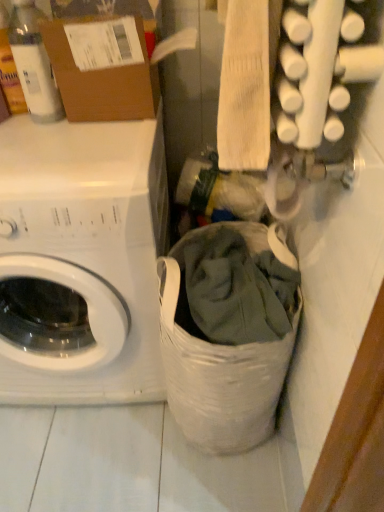
The height and width of the screenshot is (512, 384). Describe the element at coordinates (33, 63) in the screenshot. I see `translucent plastic bottle at upper left` at that location.

The image size is (384, 512). I want to click on brown cardboard box at upper left, so pyautogui.click(x=102, y=68).

Is brown cardboard box at upper left placed right next to white matte washing machine at left?

No, brown cardboard box at upper left is not next to white matte washing machine at left.

Looking at the image, does brown cardboard box at upper left seem bigger or smaller compared to white matte washing machine at left?

brown cardboard box at upper left is smaller than white matte washing machine at left.

Measure the distance between brown cardboard box at upper left and white matte washing machine at left.

brown cardboard box at upper left and white matte washing machine at left are 12.84 inches apart.

What's the angular difference between brown cardboard box at upper left and white matte washing machine at left's facing directions?

1.32 degrees.

Which object is wider, white fabric laundry basket at lower center or white matte washing machine at left?

white matte washing machine at left.

Locate an element on the screen. The height and width of the screenshot is (512, 384). washing machine above the white fabric laundry basket at lower center (from the image's perspective) is located at coordinates [81, 261].

Does white fabric laundry basket at lower center touch white matte washing machine at left?

No, white fabric laundry basket at lower center is not touching white matte washing machine at left.

Which object is thinner, white fabric laundry basket at lower center or brown cardboard box at upper left?

brown cardboard box at upper left.

Is white fabric laundry basket at lower center inside or outside of brown cardboard box at upper left?

white fabric laundry basket at lower center lies outside brown cardboard box at upper left.

Does white fabric laundry basket at lower center come behind brown cardboard box at upper left?

No, the depth of white fabric laundry basket at lower center is less than that of brown cardboard box at upper left.

You are a GUI agent. You are given a task and a screenshot of the screen. Output one action in this format:
    pyautogui.click(x=<x>, y=<y>)
    Task: Click on the cardboard box located above the white fabric laundry basket at lower center (from a real-world perspective)
    This screenshot has width=384, height=512.
    Given the screenshot: What is the action you would take?
    pyautogui.click(x=102, y=68)

In terms of height, does white matte washing machine at left look taller or shorter compared to translucent plastic bottle at upper left?

Clearly, white matte washing machine at left is taller compared to translucent plastic bottle at upper left.

From a real-world perspective, which object rests below the other?

white matte washing machine at left.

Is white matte washing machine at left looking in the opposite direction of translucent plastic bottle at upper left?

That's not correct — white matte washing machine at left is not looking away from translucent plastic bottle at upper left.

From a real-world perspective, is translucent plastic bottle at upper left on top of white matte washing machine at left?

Correct, in the physical world, translucent plastic bottle at upper left is higher than white matte washing machine at left.

In terms of size, does translucent plastic bottle at upper left appear bigger or smaller than white matte washing machine at left?

In the image, translucent plastic bottle at upper left appears to be smaller than white matte washing machine at left.

Does translucent plastic bottle at upper left have a lesser width compared to white matte washing machine at left?

Correct, the width of translucent plastic bottle at upper left is less than that of white matte washing machine at left.

Is the surface of translucent plastic bottle at upper left in direct contact with white matte washing machine at left?

They are not placed beside each other.

Between point (83, 23) and point (13, 10), which one is positioned in front?

Positioned in front is point (83, 23).

From their relative heights in the image, would you say brown cardboard box at upper left is taller or shorter than translucent plastic bottle at upper left?

In the image, brown cardboard box at upper left appears to be shorter than translucent plastic bottle at upper left.

Is brown cardboard box at upper left at the right side of translucent plastic bottle at upper left?

Yes.

Based on their sizes in the image, would you say brown cardboard box at upper left is bigger or smaller than translucent plastic bottle at upper left?

brown cardboard box at upper left is bigger than translucent plastic bottle at upper left.

From the image's perspective, is translucent plastic bottle at upper left below white fabric laundry basket at lower center?

No.

Between translucent plastic bottle at upper left and white fabric laundry basket at lower center, which one has smaller width?

Thinner between the two is translucent plastic bottle at upper left.

Based on the photo, is the depth of translucent plastic bottle at upper left greater than that of white fabric laundry basket at lower center?

Yes, translucent plastic bottle at upper left is behind white fabric laundry basket at lower center.

Where is `washing machine below the brown cardboard box at upper left (from a real-world perspective)`? The height and width of the screenshot is (512, 384). washing machine below the brown cardboard box at upper left (from a real-world perspective) is located at coordinates (81, 261).

Locate an element on the screen. laundry basket lying below the white matte washing machine at left (from the image's perspective) is located at coordinates (219, 377).

Which object lies further to the anchor point brown cardboard box at upper left, white matte washing machine at left or translucent plastic bottle at upper left?

Among the two, white matte washing machine at left is located further to brown cardboard box at upper left.

From the image, which object appears to be nearer to brown cardboard box at upper left, white fabric laundry basket at lower center or white matte washing machine at left?

white matte washing machine at left lies closer to brown cardboard box at upper left than the other object.

Looking at the image, which one is located closer to translucent plastic bottle at upper left, white matte washing machine at left or white fabric laundry basket at lower center?

white matte washing machine at left lies closer to translucent plastic bottle at upper left than the other object.

When comparing their distances from white matte washing machine at left, does brown cardboard box at upper left or white fabric laundry basket at lower center seem further?

Among the two, brown cardboard box at upper left is located further to white matte washing machine at left.

Which object lies further to the anchor point white fabric laundry basket at lower center, white matte washing machine at left or brown cardboard box at upper left?

Among the two, brown cardboard box at upper left is located further to white fabric laundry basket at lower center.

When comparing their distances from white matte washing machine at left, does white fabric laundry basket at lower center or translucent plastic bottle at upper left seem further?

The object further to white matte washing machine at left is translucent plastic bottle at upper left.

Which object lies nearer to the anchor point white fabric laundry basket at lower center, white matte washing machine at left or translucent plastic bottle at upper left?

The object closer to white fabric laundry basket at lower center is white matte washing machine at left.

Considering their positions, is translucent plastic bottle at upper left positioned closer to brown cardboard box at upper left than white fabric laundry basket at lower center?

Among the two, translucent plastic bottle at upper left is located nearer to brown cardboard box at upper left.

Find the location of `washing machine between brown cardboard box at upper left and white fabric laundry basket at lower center vertically`. washing machine between brown cardboard box at upper left and white fabric laundry basket at lower center vertically is located at coordinates (81, 261).

You are a GUI agent. You are given a task and a screenshot of the screen. Output one action in this format:
    pyautogui.click(x=<x>, y=<y>)
    Task: Click on the bottle between brown cardboard box at upper left and white matte washing machine at left in the up-down direction
    
    Given the screenshot: What is the action you would take?
    pyautogui.click(x=33, y=63)

The image size is (384, 512). I want to click on washing machine that lies between translucent plastic bottle at upper left and white fabric laundry basket at lower center from top to bottom, so [81, 261].

At what (x,y) coordinates should I click in order to perform the action: click on bottle that lies between brown cardboard box at upper left and white fabric laundry basket at lower center from top to bottom. Please return your answer as a coordinate pair (x, y). Image resolution: width=384 pixels, height=512 pixels. Looking at the image, I should click on pyautogui.click(x=33, y=63).